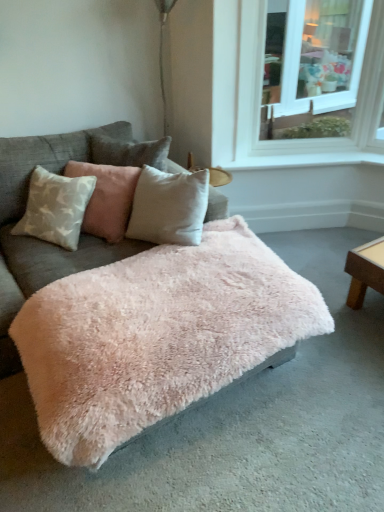
Describe the element at coordinates (133, 313) in the screenshot. This screenshot has height=512, width=384. I see `fuzzy pink ottoman at center` at that location.

Image resolution: width=384 pixels, height=512 pixels. What do you see at coordinates (107, 198) in the screenshot?
I see `velvet beige pillow at center` at bounding box center [107, 198].

What is the approximate width of white glass window at upper right?

It is 5.05 inches.

Locate an element on the screen. The height and width of the screenshot is (512, 384). fuzzy pink blanket at center is located at coordinates [42, 240].

Looking at this image, which of these two, velvet beige pillow at center or fuzzy pink ottoman at center, is bigger?

fuzzy pink ottoman at center.

Looking at this image, is velvet beige pillow at center positioned with its back to fuzzy pink ottoman at center?

velvet beige pillow at center is not turned away from fuzzy pink ottoman at center.

Would you consider velvet beige pillow at center to be distant from fuzzy pink ottoman at center?

No.

Is velvet beige pillow at center in front of or behind fuzzy pink ottoman at center in the image?

In the image, velvet beige pillow at center appears behind fuzzy pink ottoman at center.

Is point (122, 237) less distant than point (370, 158)?

Yes.

Find the location of `pillow that is in front of the white smooth window sill at upper right`. pillow that is in front of the white smooth window sill at upper right is located at coordinates (107, 198).

Considering the relative sizes of velvet beige pillow at center and white smooth window sill at upper right in the image provided, is velvet beige pillow at center thinner than white smooth window sill at upper right?

Incorrect, the width of velvet beige pillow at center is not less than that of white smooth window sill at upper right.

Can you confirm if velvet beige pillow at center is shorter than white smooth window sill at upper right?

Incorrect, the height of velvet beige pillow at center does not fall short of that of white smooth window sill at upper right.

Is point (119, 182) behind point (291, 71)?

No, (119, 182) is in front of (291, 71).

Measure the distance between velvet beige pillow at center and white glass window at upper right.

The distance of velvet beige pillow at center from white glass window at upper right is 1.08 meters.

Considering the sizes of objects velvet beige pillow at center and white glass window at upper right in the image provided, who is taller, velvet beige pillow at center or white glass window at upper right?

Standing taller between the two is white glass window at upper right.

Where is `window on the right of velvet beige pillow at center`? The image size is (384, 512). window on the right of velvet beige pillow at center is located at coordinates (296, 84).

Is white glass window at upper right far away from velvet beige pillow at center?

Indeed, white glass window at upper right is not near velvet beige pillow at center.

Between white glass window at upper right and velvet beige pillow at center, which one has less height?

velvet beige pillow at center.

Considering the positions of points (365, 92) and (87, 223), is point (365, 92) closer to camera compared to point (87, 223)?

That is False.

You are a GUI agent. You are given a task and a screenshot of the screen. Output one action in this format:
    pyautogui.click(x=<x>, y=<y>)
    Task: Click on the pillow that appears below the white glass window at upper right (from a real-world perspective)
    The image size is (384, 512).
    Given the screenshot: What is the action you would take?
    pyautogui.click(x=107, y=198)

Is point (284, 163) in front of point (36, 269)?

No.

Would you say white smooth window sill at upper right is inside or outside fuzzy pink blanket at center?

white smooth window sill at upper right is located beyond the bounds of fuzzy pink blanket at center.

Is white smooth window sill at upper right positioned with its back to fuzzy pink blanket at center?

That's not correct — white smooth window sill at upper right is not looking away from fuzzy pink blanket at center.

From a real-world perspective, between white smooth window sill at upper right and fuzzy pink blanket at center, who is vertically higher?

In real-world perspective, white smooth window sill at upper right is above.

How distant is fuzzy pink ottoman at center from white smooth window sill at upper right?

They are 4.07 feet apart.

Consider the image. Is the depth of fuzzy pink ottoman at center greater than that of white smooth window sill at upper right?

No, it is in front of white smooth window sill at upper right.

From the image's perspective, is fuzzy pink ottoman at center located above or below white smooth window sill at upper right?

From the image's perspective, fuzzy pink ottoman at center appears below white smooth window sill at upper right.

You are a GUI agent. You are given a task and a screenshot of the screen. Output one action in this format:
    pyautogui.click(x=<x>, y=<y>)
    Task: Click on the window sill that appears behind the fuzzy pink ottoman at center
    
    Given the screenshot: What is the action you would take?
    pyautogui.click(x=303, y=160)

The width and height of the screenshot is (384, 512). What are the coordinates of `window sill above the fuzzy pink blanket at center (from the image's perspective)` in the screenshot? It's located at (303, 160).

Is fuzzy pink blanket at center completely or partially outside of white smooth window sill at upper right?

Yes, fuzzy pink blanket at center is outside of white smooth window sill at upper right.

Are fuzzy pink blanket at center and white smooth window sill at upper right making contact?

No, fuzzy pink blanket at center is not in contact with white smooth window sill at upper right.

From the image's perspective, is fuzzy pink blanket at center on top of white smooth window sill at upper right?

Incorrect, from the image's perspective, fuzzy pink blanket at center is lower than white smooth window sill at upper right.

Where is `pillow that appears behind the fuzzy pink ottoman at center`? pillow that appears behind the fuzzy pink ottoman at center is located at coordinates (107, 198).

You are a GUI agent. You are given a task and a screenshot of the screen. Output one action in this format:
    pyautogui.click(x=<x>, y=<y>)
    Task: Click on the pillow above the white smooth window sill at upper right (from a real-world perspective)
    This screenshot has width=384, height=512.
    Given the screenshot: What is the action you would take?
    pyautogui.click(x=107, y=198)

Based on their spatial positions, is fuzzy pink blanket at center or white glass window at upper right closer to white smooth window sill at upper right?

white glass window at upper right lies closer to white smooth window sill at upper right than the other object.

When comparing their distances from fuzzy pink ottoman at center, does white smooth window sill at upper right or velvet beige pillow at center seem closer?

velvet beige pillow at center is positioned closer to the anchor fuzzy pink ottoman at center.

Based on their spatial positions, is white glass window at upper right or velvet beige pillow at center closer to fuzzy pink blanket at center?

Among the two, velvet beige pillow at center is located nearer to fuzzy pink blanket at center.

Based on the photo, from the image, which object appears to be nearer to white glass window at upper right, velvet beige pillow at center or white smooth window sill at upper right?

white smooth window sill at upper right is closer to white glass window at upper right.

Estimate the real-world distances between objects in this image. Which object is further from white glass window at upper right, velvet beige pillow at center or fuzzy pink blanket at center?

The object further to white glass window at upper right is fuzzy pink blanket at center.

Looking at this image, when comparing their distances from fuzzy pink blanket at center, does fuzzy pink ottoman at center or white glass window at upper right seem closer?

fuzzy pink ottoman at center is positioned closer to the anchor fuzzy pink blanket at center.

Considering their positions, is white smooth window sill at upper right positioned closer to fuzzy pink blanket at center than white glass window at upper right?

white smooth window sill at upper right is closer to fuzzy pink blanket at center.

Looking at the image, which one is located further to velvet beige pillow at center, white glass window at upper right or fuzzy pink blanket at center?

white glass window at upper right.

At what (x,y) coordinates should I click in order to perform the action: click on pillow between fuzzy pink blanket at center and white smooth window sill at upper right from left to right. Please return your answer as a coordinate pair (x, y). The height and width of the screenshot is (512, 384). Looking at the image, I should click on (107, 198).

Find the location of `window sill between velvet beige pillow at center and white glass window at upper right in the horizontal direction`. window sill between velvet beige pillow at center and white glass window at upper right in the horizontal direction is located at coordinates (303, 160).

Where is `pillow positioned between fuzzy pink ottoman at center and white glass window at upper right from near to far`? This screenshot has width=384, height=512. pillow positioned between fuzzy pink ottoman at center and white glass window at upper right from near to far is located at coordinates (107, 198).

At what (x,y) coordinates should I click in order to perform the action: click on window between fuzzy pink ottoman at center and white smooth window sill at upper right in the front-back direction. Please return your answer as a coordinate pair (x, y). The image size is (384, 512). Looking at the image, I should click on (296, 84).